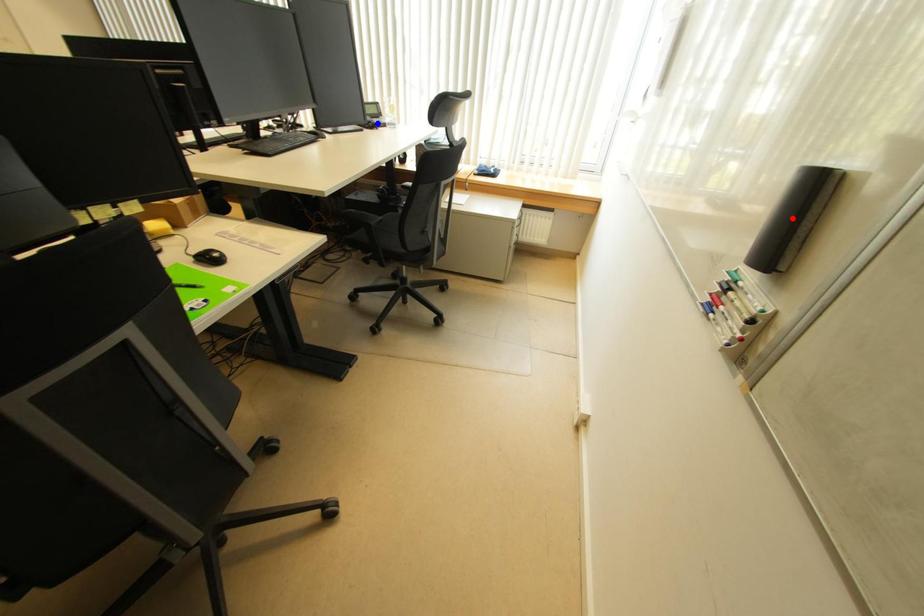
Question: Which of the two points in the image is closer to the camera?

Choices:
 (A) Blue point is closer.
 (B) Red point is closer.

Answer: (B)